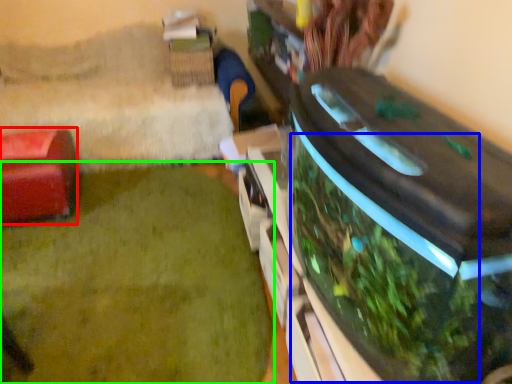
Question: Which object is positioned farthest from furniture (highlighted by a red box)? Select from vegetation (highlighted by a blue box) and plant (highlighted by a green box).

Choices:
 (A) vegetation
 (B) plant

Answer: (A)